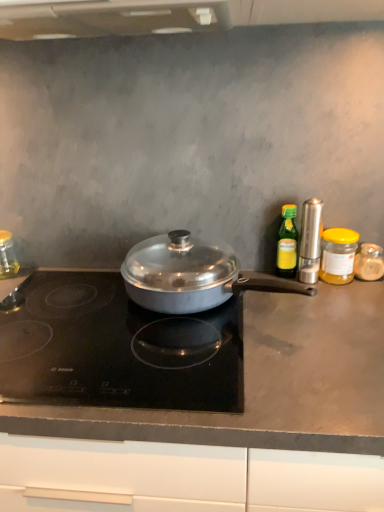
Locate an element on the screen. This screenshot has width=384, height=512. vacant space that is to the left of satin silver pan at center, which ranks as the fifth kitchen appliance in right-to-left order is located at coordinates (52, 308).